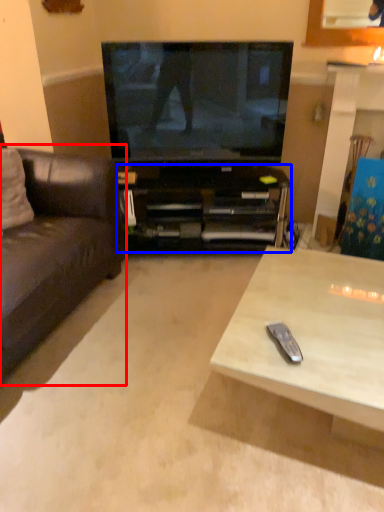
Question: Which point is further to the camera, studio couch (highlighted by a red box) or cabinetry (highlighted by a blue box)?

Choices:
 (A) studio couch
 (B) cabinetry

Answer: (B)